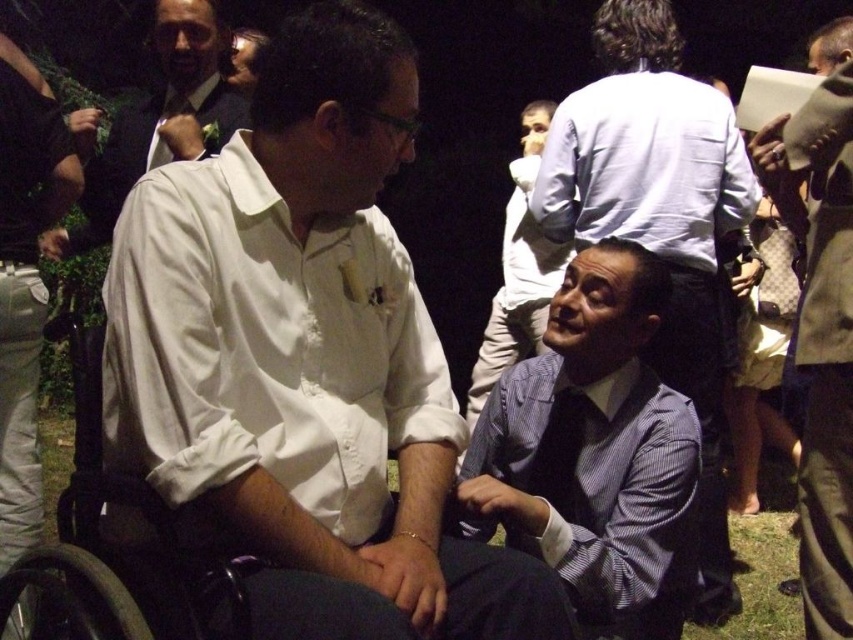
You are a photographer at the event and need to ensure both the white satin tie at upper left and the light blue striped shirt at center are visible in your photo. Given their sizes, which one might require you to adjust your camera focus more carefully to avoid blurring?

The white satin tie at upper left is smaller than the light blue striped shirt at center, so it might require more careful focus adjustment to avoid blurring due to its smaller size.